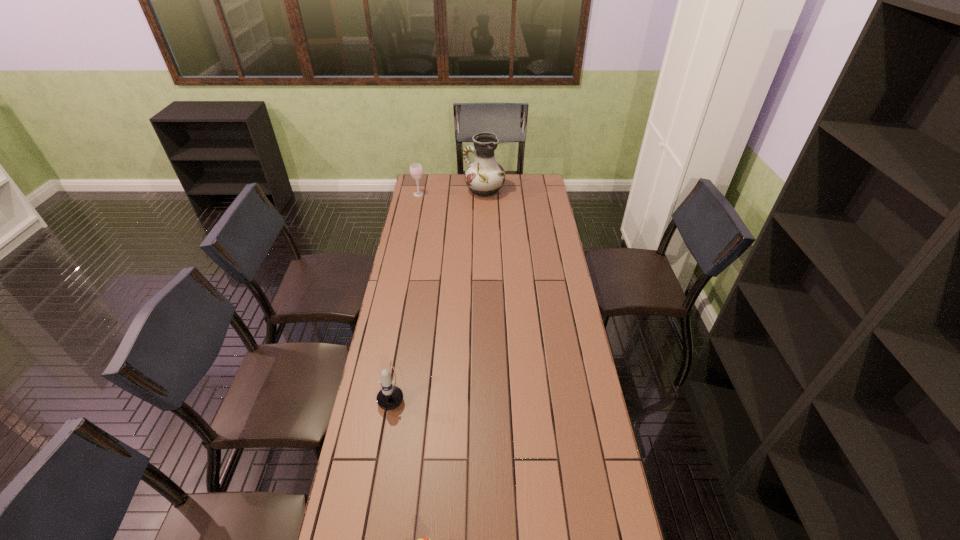
Identify the location of free space in the image that satisfies the following two spatial constraints: 1. on the front side of the microphone; 2. on the right side of the wineglass. This screenshot has height=540, width=960. (381, 386).